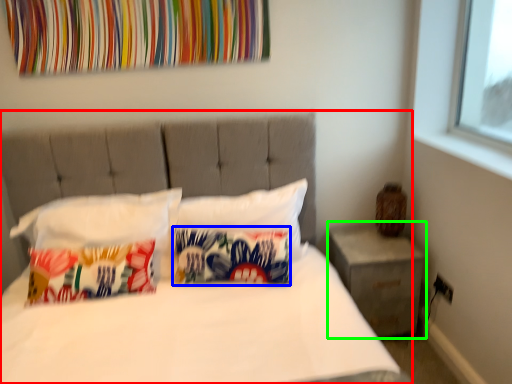
Question: Which object is positioned farthest from bed (highlighted by a red box)? Select from pillow (highlighted by a blue box) and nightstand (highlighted by a green box).

Choices:
 (A) pillow
 (B) nightstand

Answer: (B)